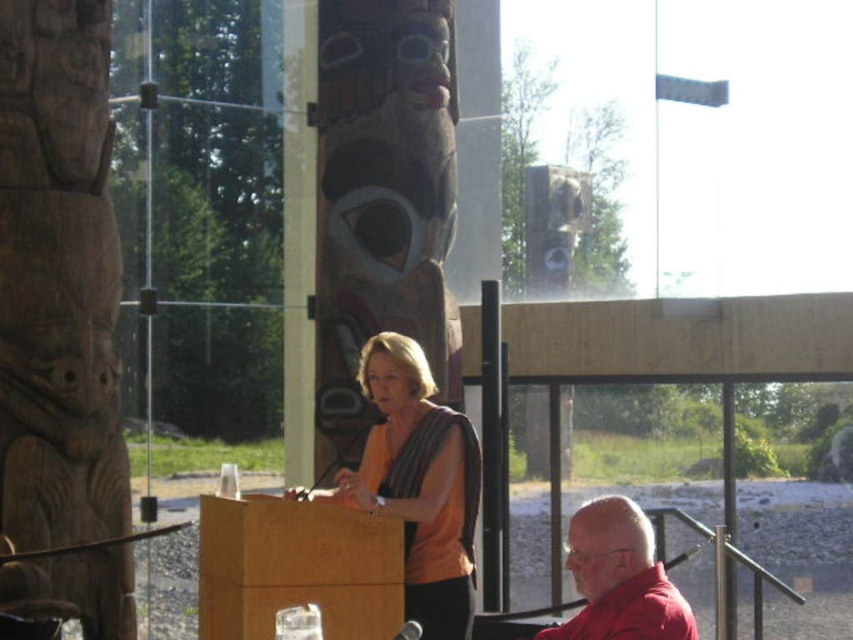
Is wooden totem pole at center taller than orange matte shirt at center?

Yes.

Can you confirm if wooden totem pole at center is thinner than orange matte shirt at center?

In fact, wooden totem pole at center might be wider than orange matte shirt at center.

Between point (352, 42) and point (476, 436), which one is positioned behind?

The point (352, 42) is behind.

What are the coordinates of `wooden totem pole at center` in the screenshot? It's located at (380, 204).

Where is `wooden totem pole at left`? The image size is (853, 640). wooden totem pole at left is located at coordinates (57, 280).

Describe the element at coordinates (57, 280) in the screenshot. I see `wooden totem pole at left` at that location.

Find the location of `wooden totem pole at left`. wooden totem pole at left is located at coordinates coord(57,280).

Does wooden totem pole at left have a larger size compared to wooden totem pole at center?

No.

Which is in front, point (102, 116) or point (334, 474)?

Point (102, 116)

Image resolution: width=853 pixels, height=640 pixels. What are the coordinates of `wooden totem pole at left` in the screenshot? It's located at (57, 280).